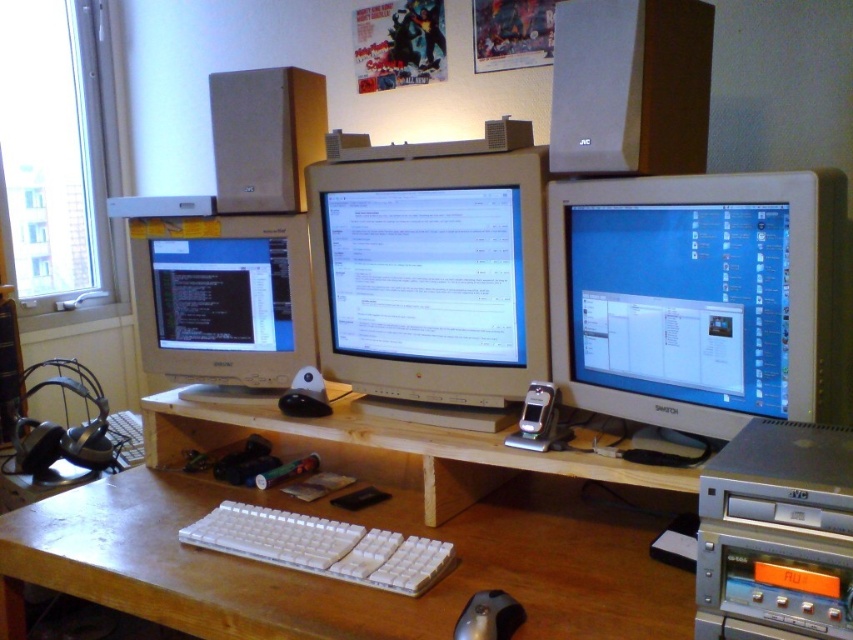
Who is positioned more to the left, white wood computer desk at center or white plastic keyboard at center?

white plastic keyboard at center is more to the left.

Between white wood computer desk at center and white plastic keyboard at center, which one is positioned lower?

white plastic keyboard at center is below.

Locate an element on the screen. The image size is (853, 640). white wood computer desk at center is located at coordinates (366, 525).

Image resolution: width=853 pixels, height=640 pixels. Find the location of `white wood computer desk at center`. white wood computer desk at center is located at coordinates click(366, 525).

Between point (630, 403) and point (397, 248), which one is positioned behind?

Point (397, 248)

This screenshot has height=640, width=853. What do you see at coordinates (699, 298) in the screenshot? I see `white glossy monitor at center right` at bounding box center [699, 298].

Who is more forward, [563,344] or [314,209]?

Point [563,344] is more forward.

This screenshot has height=640, width=853. I want to click on white glossy monitor at center right, so click(x=699, y=298).

Is point (225, 164) farther from camera compared to point (370, 547)?

Yes.

Between point (312, 124) and point (227, 541), which one is positioned behind?

The point (312, 124) is more distant.

Which is in front, point (281, 68) or point (202, 518)?

Point (202, 518) is more forward.

You are a GUI agent. You are given a task and a screenshot of the screen. Output one action in this format:
    pyautogui.click(x=<x>, y=<y>)
    Task: Click on the matte beige speaker at upper center
    
    Given the screenshot: What is the action you would take?
    pyautogui.click(x=265, y=136)